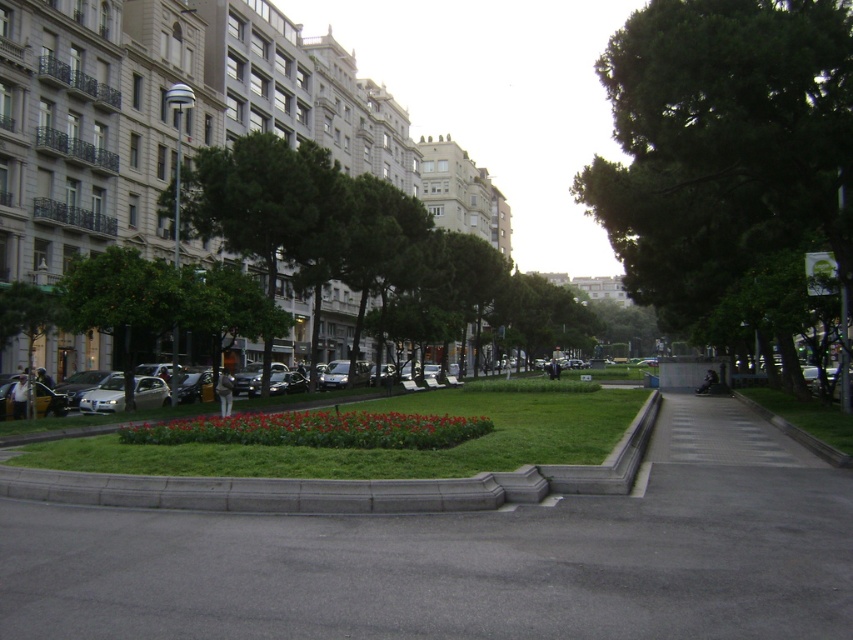
Can you confirm if gray asphalt pavement at center is smaller than green leafy tree at center?

Yes.

From the picture: Who is more forward, (656, 512) or (769, 230)?

Point (656, 512) is in front.

Identify the location of gray asphalt pavement at center. (451, 566).

The height and width of the screenshot is (640, 853). I want to click on gray asphalt pavement at center, so click(x=451, y=566).

Who is taller, gray concrete curb at lower center or green grass at lower right?

Standing taller between the two is green grass at lower right.

Is gray concrete curb at lower center to the left of green grass at lower right from the viewer's perspective?

Indeed, gray concrete curb at lower center is positioned on the left side of green grass at lower right.

Find the location of `gray concrete curb at lower center`. gray concrete curb at lower center is located at coordinates (317, 490).

The image size is (853, 640). I want to click on gray concrete curb at lower center, so click(x=317, y=490).

Does point (732, 182) lie behind point (850, 420)?

Yes.

Does green leafy tree at center have a larger size compared to green grass at lower right?

Indeed, green leafy tree at center has a larger size compared to green grass at lower right.

Does point (698, 147) come farther from viewer compared to point (780, 392)?

No, it is in front of (780, 392).

I want to click on green leafy tree at center, so click(x=724, y=145).